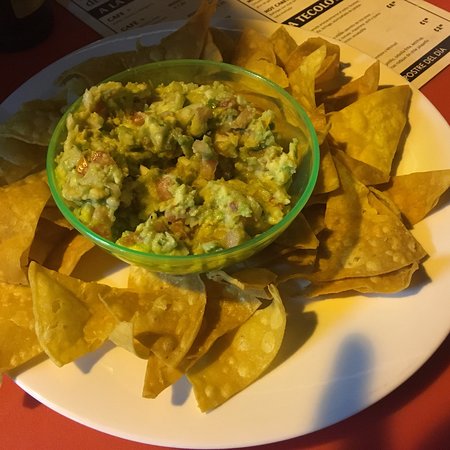
Image resolution: width=450 pixels, height=450 pixels. What are the coordinates of `small green plastic bowl` in the screenshot? It's located at (177, 263).